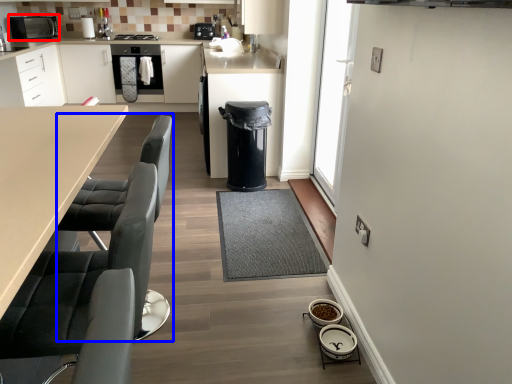
Question: Which of the following is the farthest to the observer, home appliance (highlighted by a red box) or swivel chair (highlighted by a blue box)?

Choices:
 (A) home appliance
 (B) swivel chair

Answer: (A)